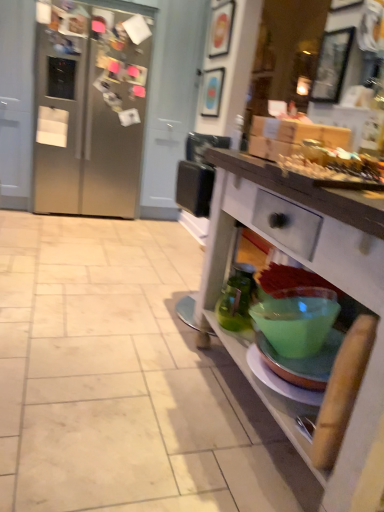
This screenshot has width=384, height=512. Describe the element at coordinates (332, 65) in the screenshot. I see `wooden picture frame at upper right, which appears as the third picture frame when viewed from the top` at that location.

What is the approximate height of satin silver refrigerator at left?

satin silver refrigerator at left is 1.75 meters tall.

In order to face wooden picture frame at upper center, the 3th picture frame ordered from the bottom, should I rotate leftwards or rightwards?

Turn right approximately 3.656 degrees to face it.

Find the location of a particular element. wooden picture frame at upper right, the first picture frame ordered from the bottom is located at coordinates click(x=332, y=65).

Is wooden picture frame at upper right, which is the 3th picture frame in left-to-right order, positioned far away from wooden picture frame at upper center, which is counted as the 2th picture frame, starting from the front?

Yes, wooden picture frame at upper right, which is the 3th picture frame in left-to-right order, and wooden picture frame at upper center, which is counted as the 2th picture frame, starting from the front, are quite far apart.

Between wooden picture frame at upper right, placed as the first picture frame when sorted from front to back, and wooden picture frame at upper center, which is the 1th picture frame in top-to-bottom order, which one appears on the right side from the viewer's perspective?

From the viewer's perspective, wooden picture frame at upper right, placed as the first picture frame when sorted from front to back, appears more on the right side.

Based on their sizes in the image, would you say wooden picture frame at upper right, the first picture frame ordered from the bottom, is bigger or smaller than wooden picture frame at upper center, acting as the 2th picture frame starting from the right?

In the image, wooden picture frame at upper right, the first picture frame ordered from the bottom, appears to be smaller than wooden picture frame at upper center, acting as the 2th picture frame starting from the right.

How much distance is there between wooden picture frame at upper right, placed as the first picture frame when sorted from front to back, and wooden picture frame at upper center, which is the 1th picture frame in top-to-bottom order?

The distance of wooden picture frame at upper right, placed as the first picture frame when sorted from front to back, from wooden picture frame at upper center, which is the 1th picture frame in top-to-bottom order, is 5.05 feet.

Is matte blue picture frame at upper center, marked as the third picture frame in a front-to-back arrangement, shorter than wooden picture frame at upper right, which appears as the third picture frame when viewed from the top?

Incorrect, the height of matte blue picture frame at upper center, marked as the third picture frame in a front-to-back arrangement, does not fall short of that of wooden picture frame at upper right, which appears as the third picture frame when viewed from the top.

From a real-world perspective, is matte blue picture frame at upper center, the 1th picture frame from the back, below wooden picture frame at upper right, which is the 3th picture frame in left-to-right order?

Yes, from a real-world perspective, matte blue picture frame at upper center, the 1th picture frame from the back, is under wooden picture frame at upper right, which is the 3th picture frame in left-to-right order.

Which object is further away from the camera taking this photo, matte blue picture frame at upper center, which ranks as the 1th picture frame in left-to-right order, or wooden picture frame at upper right, which appears as the third picture frame when viewed from the top?

matte blue picture frame at upper center, which ranks as the 1th picture frame in left-to-right order, is more distant.

Consider the image. Are matte blue picture frame at upper center, the 2th picture frame positioned from the bottom, and wooden picture frame at upper right, the 3th picture frame when ordered from back to front, far apart?

Yes, matte blue picture frame at upper center, the 2th picture frame positioned from the bottom, is far from wooden picture frame at upper right, the 3th picture frame when ordered from back to front.

Is wooden picture frame at upper right, which is the 3th picture frame in left-to-right order, positioned with its back to satin silver refrigerator at left?

No, wooden picture frame at upper right, which is the 3th picture frame in left-to-right order, is not facing the opposite direction of satin silver refrigerator at left.

Between wooden picture frame at upper right, the first picture frame ordered from the bottom, and satin silver refrigerator at left, which one appears on the right side from the viewer's perspective?

Positioned to the right is wooden picture frame at upper right, the first picture frame ordered from the bottom.

From a real-world perspective, is wooden picture frame at upper right, which appears as the third picture frame when viewed from the top, physically located above or below satin silver refrigerator at left?

wooden picture frame at upper right, which appears as the third picture frame when viewed from the top, is situated higher than satin silver refrigerator at left in the real world.

In terms of size, does wooden picture frame at upper right, which is the 3th picture frame in left-to-right order, appear bigger or smaller than satin silver refrigerator at left?

→ In the image, wooden picture frame at upper right, which is the 3th picture frame in left-to-right order, appears to be smaller than satin silver refrigerator at left.

This screenshot has height=512, width=384. Identify the location of refrigerator that is below the matte blue picture frame at upper center, the 2th picture frame positioned from the bottom (from the image's perspective). (91, 109).

Between matte blue picture frame at upper center, marked as the third picture frame in a front-to-back arrangement, and satin silver refrigerator at left, which one has larger width?

satin silver refrigerator at left is wider.

From the image's perspective, between matte blue picture frame at upper center, the 1th picture frame from the back, and wooden picture frame at upper center, which is the second picture frame in back-to-front order, who is located below?

matte blue picture frame at upper center, the 1th picture frame from the back.

Based on the photo, who is more distant, matte blue picture frame at upper center, the 3th picture frame positioned from the right, or wooden picture frame at upper center, acting as the 2th picture frame starting from the right?

matte blue picture frame at upper center, the 3th picture frame positioned from the right, is more distant.

Is wooden picture frame at upper center, which is the 1th picture frame in top-to-bottom order, inside the boundaries of matte blue picture frame at upper center, the 3th picture frame positioned from the right, or outside?

wooden picture frame at upper center, which is the 1th picture frame in top-to-bottom order, is outside matte blue picture frame at upper center, the 3th picture frame positioned from the right.

Is wooden picture frame at upper center, which is the second picture frame in back-to-front order, looking in the opposite direction of matte blue picture frame at upper center, the 3th picture frame positioned from the right?

No.

Consider the image. Is wooden picture frame at upper center, which is the second picture frame in back-to-front order, thinner than matte blue picture frame at upper center, marked as the third picture frame in a front-to-back arrangement?

No, wooden picture frame at upper center, which is the second picture frame in back-to-front order, is not thinner than matte blue picture frame at upper center, marked as the third picture frame in a front-to-back arrangement.

Find the location of a particular element. The image size is (384, 512). the 2nd picture frame located above the matte blue picture frame at upper center, which appears as the 2th picture frame when viewed from the top (from a real-world perspective) is located at coordinates (221, 29).

From a real-world perspective, is wooden picture frame at upper center, which is the second picture frame in back-to-front order, positioned under satin silver refrigerator at left based on gravity?

Incorrect, from a real-world perspective, wooden picture frame at upper center, which is the second picture frame in back-to-front order, is higher than satin silver refrigerator at left.

Does wooden picture frame at upper center, the second picture frame from the left, lie behind satin silver refrigerator at left?

That is True.

Is wooden picture frame at upper center, which is the 1th picture frame in top-to-bottom order, wider than satin silver refrigerator at left?

No, wooden picture frame at upper center, which is the 1th picture frame in top-to-bottom order, is not wider than satin silver refrigerator at left.

Considering the sizes of objects wooden picture frame at upper center, acting as the 2th picture frame starting from the right, and satin silver refrigerator at left in the image provided, who is smaller, wooden picture frame at upper center, acting as the 2th picture frame starting from the right, or satin silver refrigerator at left?

wooden picture frame at upper center, acting as the 2th picture frame starting from the right, is smaller.

The height and width of the screenshot is (512, 384). In order to click on the 1st picture frame directly beneath the wooden picture frame at upper center, which is the second picture frame in back-to-front order (from a real-world perspective) in this screenshot , I will do `click(332, 65)`.

Find the location of a particular element. The width and height of the screenshot is (384, 512). picture frame that is the 2nd object located behind the wooden picture frame at upper right, the first picture frame ordered from the bottom is located at coordinates (212, 92).

When comparing their distances from wooden picture frame at upper center, the second picture frame from the left, does matte blue picture frame at upper center, the 3th picture frame positioned from the right, or wooden picture frame at upper right, which appears as the third picture frame when viewed from the top, seem further?

wooden picture frame at upper right, which appears as the third picture frame when viewed from the top, is further to wooden picture frame at upper center, the second picture frame from the left.

From the image, which object appears to be nearer to satin silver refrigerator at left, wooden picture frame at upper center, acting as the 2th picture frame starting from the right, or matte blue picture frame at upper center, which appears as the 2th picture frame when viewed from the top?

matte blue picture frame at upper center, which appears as the 2th picture frame when viewed from the top, lies closer to satin silver refrigerator at left than the other object.

Estimate the real-world distances between objects in this image. Which object is closer to wooden picture frame at upper right, placed as the first picture frame when sorted from front to back, wooden picture frame at upper center, the second picture frame from the left, or satin silver refrigerator at left?

wooden picture frame at upper center, the second picture frame from the left.

Looking at the image, which one is located closer to matte blue picture frame at upper center, which ranks as the 1th picture frame in left-to-right order, wooden picture frame at upper center, which is the 1th picture frame in top-to-bottom order, or satin silver refrigerator at left?

wooden picture frame at upper center, which is the 1th picture frame in top-to-bottom order, is closer to matte blue picture frame at upper center, which ranks as the 1th picture frame in left-to-right order.

Which object lies nearer to the anchor point wooden picture frame at upper right, which is the 3th picture frame in left-to-right order, satin silver refrigerator at left or wooden picture frame at upper center, the 3th picture frame ordered from the bottom?

wooden picture frame at upper center, the 3th picture frame ordered from the bottom, lies closer to wooden picture frame at upper right, which is the 3th picture frame in left-to-right order, than the other object.

When comparing their distances from wooden picture frame at upper right, placed as the first picture frame when sorted from front to back, does satin silver refrigerator at left or matte blue picture frame at upper center, marked as the third picture frame in a front-to-back arrangement, seem closer?

matte blue picture frame at upper center, marked as the third picture frame in a front-to-back arrangement, is closer to wooden picture frame at upper right, placed as the first picture frame when sorted from front to back.

Based on their spatial positions, is matte blue picture frame at upper center, which ranks as the 1th picture frame in left-to-right order, or satin silver refrigerator at left closer to wooden picture frame at upper right, which appears as the third picture frame when viewed from the top?

Based on the image, matte blue picture frame at upper center, which ranks as the 1th picture frame in left-to-right order, appears to be nearer to wooden picture frame at upper right, which appears as the third picture frame when viewed from the top.

Estimate the real-world distances between objects in this image. Which object is further from satin silver refrigerator at left, matte blue picture frame at upper center, the 3th picture frame positioned from the right, or wooden picture frame at upper center, which is counted as the 2th picture frame, starting from the front?

wooden picture frame at upper center, which is counted as the 2th picture frame, starting from the front.

This screenshot has height=512, width=384. Identify the location of picture frame between satin silver refrigerator at left and wooden picture frame at upper center, the second picture frame from the left, from left to right. (212, 92).

Identify the location of picture frame positioned between wooden picture frame at upper right, the 3th picture frame when ordered from back to front, and matte blue picture frame at upper center, which ranks as the 1th picture frame in left-to-right order, from near to far. (221, 29).